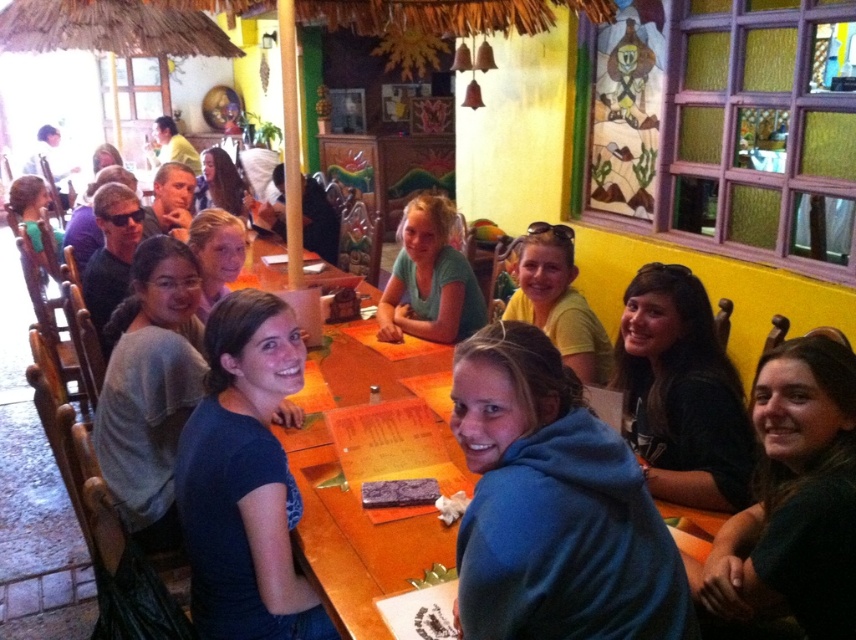
Between dark brown leather jacket at lower right and white paper napkin at lower center, which one has less height?

white paper napkin at lower center is shorter.

Describe the element at coordinates (681, 392) in the screenshot. This screenshot has height=640, width=856. I see `dark brown leather jacket at lower right` at that location.

The image size is (856, 640). I want to click on dark brown leather jacket at lower right, so click(681, 392).

Can you confirm if dark green hoodie at lower right is bigger than matte black hair at center?

Actually, dark green hoodie at lower right might be smaller than matte black hair at center.

This screenshot has height=640, width=856. In order to click on dark green hoodie at lower right in this screenshot , I will do `click(795, 497)`.

Is point (840, 579) in front of point (232, 195)?

Yes, point (840, 579) is in front of point (232, 195).

I want to click on dark green hoodie at lower right, so click(795, 497).

Is purple matte napkin at lower center to the left of white paper napkin at lower center from the viewer's perspective?

Yes, purple matte napkin at lower center is to the left of white paper napkin at lower center.

Identify the location of purple matte napkin at lower center. (399, 492).

Image resolution: width=856 pixels, height=640 pixels. In order to click on purple matte napkin at lower center in this screenshot , I will do `click(399, 492)`.